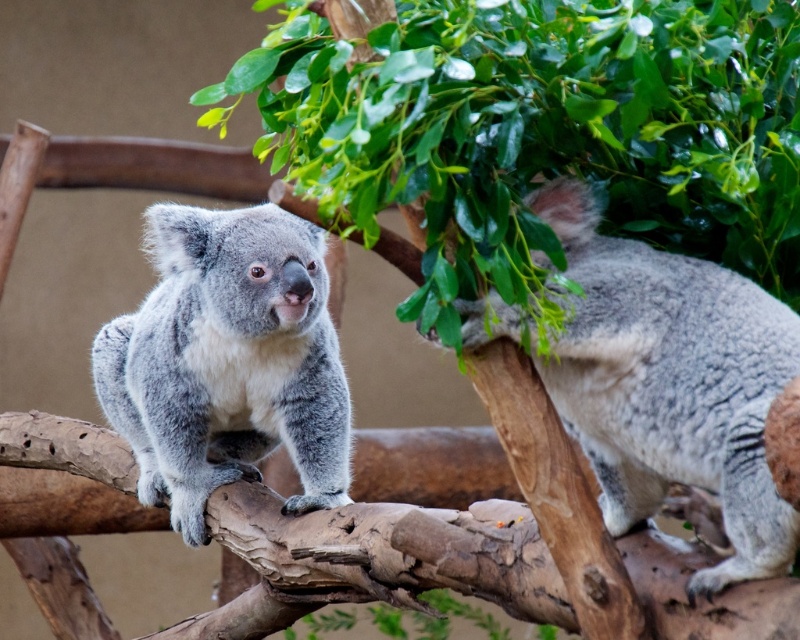
In the scene shown: You are a zookeeper who needs to feed two gray fluffy koalas. You have a food tray that can be extended up to 1.2 meters. If you are standing next to the gray fluffy koala at center, can you reach the gray fluffy koala at right with the food tray?

The distance between the gray fluffy koala at right and the gray fluffy koala at center is 1.19 meters. Since the food tray can extend up to 1.2 meters, you can reach the gray fluffy koala at right by extending the tray fully.

You are a zookeeper observing two gray fluffy koalas in the enclosure. You need to determine which one is shorter between the gray fluffy koala at right and the gray fluffy koala at center. Based on their positions, which one is shorter?

The gray fluffy koala at right is not as tall as the gray fluffy koala at center, so the gray fluffy koala at right is shorter.